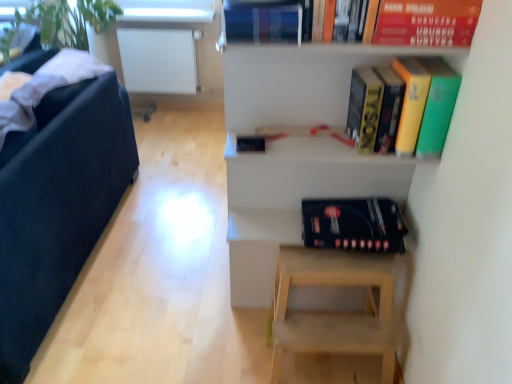
What is the approximate width of white matte radiator at upper left?

The width of white matte radiator at upper left is 8.90 inches.

Identify the location of black fabric armchair at left. (58, 206).

This screenshot has height=384, width=512. Describe the element at coordinates (58, 206) in the screenshot. I see `black fabric armchair at left` at that location.

The image size is (512, 384). I want to click on hardcover book at upper center, the 1th paperback book viewed from the left, so click(263, 21).

Find the location of a particular element. The image size is (512, 384). white matte radiator at upper left is located at coordinates (158, 60).

Is black fabric armchair at left facing towards white matte shelf at upper right?

No, black fabric armchair at left is not oriented towards white matte shelf at upper right.

You are a GUI agent. You are given a task and a screenshot of the screen. Output one action in this format:
    pyautogui.click(x=<x>, y=<y>)
    Task: Click on the armchair below the white matte shelf at upper right (from a real-world perspective)
    The width and height of the screenshot is (512, 384).
    Given the screenshot: What is the action you would take?
    pyautogui.click(x=58, y=206)

Considering the sizes of black fabric armchair at left and white matte shelf at upper right in the image, is black fabric armchair at left taller or shorter than white matte shelf at upper right?

Considering their sizes, black fabric armchair at left has less height than white matte shelf at upper right.

Is point (10, 203) more distant than point (234, 161)?

No, (10, 203) is closer to viewer.

Looking at the image, does orange matte paperback book at upper right, which appears as the first paperback book when viewed from the right, seem bigger or smaller compared to black matte album at lower center?

orange matte paperback book at upper right, which appears as the first paperback book when viewed from the right, is smaller than black matte album at lower center.

Between orange matte paperback book at upper right, which appears as the first paperback book when viewed from the right, and black matte album at lower center, which one appears on the right side from the viewer's perspective?

From the viewer's perspective, orange matte paperback book at upper right, which appears as the first paperback book when viewed from the right, appears more on the right side.

Can you confirm if orange matte paperback book at upper right, which appears as the first paperback book when viewed from the right, is thinner than black matte album at lower center?

Yes.

What's the angular difference between orange matte paperback book at upper right, positioned as the second paperback book in left-to-right order, and black matte album at lower center's facing directions?

11.2 degrees separate the facing orientations of orange matte paperback book at upper right, positioned as the second paperback book in left-to-right order, and black matte album at lower center.

Would you say hardcover book at upper center, placed as the 2th paperback book when sorted from right to left, contains hardcover book at upper right?

No, hardcover book at upper right is not inside hardcover book at upper center, placed as the 2th paperback book when sorted from right to left.

Is hardcover book at upper center, the 1th paperback book viewed from the left, bigger than hardcover book at upper right?

Incorrect, hardcover book at upper center, the 1th paperback book viewed from the left, is not larger than hardcover book at upper right.

The width and height of the screenshot is (512, 384). I want to click on the 1st paperback book above the hardcover book at upper right (from a real-world perspective), so click(263, 21).

Is hardcover book at upper center, the 1th paperback book viewed from the left, directly adjacent to hardcover book at upper right?

hardcover book at upper center, the 1th paperback book viewed from the left, and hardcover book at upper right are clearly separated.

Which is correct: black fabric armchair at left is inside white matte radiator at upper left, or outside of it?

The correct answer is: outside.

From a real-world perspective, does black fabric armchair at left stand above white matte radiator at upper left?

Yes, from a real-world perspective, black fabric armchair at left is above white matte radiator at upper left.

Which object is positioned more to the right, black fabric armchair at left or white matte radiator at upper left?

Positioned to the right is white matte radiator at upper left.

From a real-world perspective, is black matte album at lower center positioned above or below white matte radiator at upper left?

Clearly, from a real-world perspective, black matte album at lower center is above white matte radiator at upper left.

Is black matte album at lower center facing away from white matte radiator at upper left?

black matte album at lower center is not turned away from white matte radiator at upper left.

Considering the sizes of objects black matte album at lower center and white matte radiator at upper left in the image provided, who is wider, black matte album at lower center or white matte radiator at upper left?

black matte album at lower center is wider.

Are black matte album at lower center and white matte radiator at upper left beside each other?

There is a gap between black matte album at lower center and white matte radiator at upper left.

Is white matte radiator at upper left not within white matte shelf at upper right?

Yes, white matte radiator at upper left is located beyond the bounds of white matte shelf at upper right.

Is white matte radiator at upper left next to white matte shelf at upper right?

No, white matte radiator at upper left is not next to white matte shelf at upper right.

From a real-world perspective, between white matte radiator at upper left and white matte shelf at upper right, who is vertically higher?

white matte shelf at upper right.

In the image, there is a white matte shelf at upper right. Where is `radiator below it (from a real-world perspective)`? The width and height of the screenshot is (512, 384). radiator below it (from a real-world perspective) is located at coordinates (158, 60).

From the image's perspective, is hardcover book at upper center, the 1th paperback book viewed from the left, above orange matte paperback book at upper right, which appears as the first paperback book when viewed from the right?

No, from the image's perspective, hardcover book at upper center, the 1th paperback book viewed from the left, is not above orange matte paperback book at upper right, which appears as the first paperback book when viewed from the right.

How many degrees apart are the facing directions of hardcover book at upper center, placed as the 2th paperback book when sorted from right to left, and orange matte paperback book at upper right, positioned as the second paperback book in left-to-right order?

The angle between the facing direction of hardcover book at upper center, placed as the 2th paperback book when sorted from right to left, and the facing direction of orange matte paperback book at upper right, positioned as the second paperback book in left-to-right order, is 1.35 degrees.

Is hardcover book at upper center, the 1th paperback book viewed from the left, situated inside orange matte paperback book at upper right, which appears as the first paperback book when viewed from the right, or outside?

hardcover book at upper center, the 1th paperback book viewed from the left, is outside orange matte paperback book at upper right, which appears as the first paperback book when viewed from the right.

Considering the relative sizes of hardcover book at upper center, placed as the 2th paperback book when sorted from right to left, and orange matte paperback book at upper right, which appears as the first paperback book when viewed from the right, in the image provided, is hardcover book at upper center, placed as the 2th paperback book when sorted from right to left, wider than orange matte paperback book at upper right, which appears as the first paperback book when viewed from the right,?

Yes, hardcover book at upper center, placed as the 2th paperback book when sorted from right to left, is wider than orange matte paperback book at upper right, which appears as the first paperback book when viewed from the right.

You are a GUI agent. You are given a task and a screenshot of the screen. Output one action in this format:
    pyautogui.click(x=<x>, y=<y>)
    Task: Click on the shelf above the black fabric armchair at left (from a real-world perspective)
    This screenshot has height=384, width=512.
    Given the screenshot: What is the action you would take?
    pyautogui.click(x=297, y=148)

Locate an element on the screen. The height and width of the screenshot is (384, 512). album below the orange matte paperback book at upper right, which appears as the first paperback book when viewed from the right (from the image's perspective) is located at coordinates (354, 224).

Looking at this image, based on their spatial positions, is white matte radiator at upper left or hardcover book at upper center, the 1th paperback book viewed from the left, closer to hardcover book at upper right?

hardcover book at upper center, the 1th paperback book viewed from the left.

Looking at the image, which one is located closer to white matte radiator at upper left, black fabric armchair at left or black matte album at lower center?

Among the two, black fabric armchair at left is located nearer to white matte radiator at upper left.

From the image, which object appears to be nearer to black matte album at lower center, orange matte paperback book at upper right, which appears as the first paperback book when viewed from the right, or hardcover book at upper center, the 1th paperback book viewed from the left?

orange matte paperback book at upper right, which appears as the first paperback book when viewed from the right.

Based on the photo, based on their spatial positions, is white matte shelf at upper right or black matte album at lower center closer to white matte radiator at upper left?

white matte shelf at upper right.

From the image, which object appears to be nearer to white matte shelf at upper right, hardcover book at upper right or black fabric armchair at left?

hardcover book at upper right.

Estimate the real-world distances between objects in this image. Which object is closer to white matte radiator at upper left, black fabric armchair at left or hardcover book at upper right?

black fabric armchair at left lies closer to white matte radiator at upper left than the other object.

From the image, which object appears to be nearer to white matte radiator at upper left, hardcover book at upper center, the 1th paperback book viewed from the left, or hardcover book at upper right?

Based on the image, hardcover book at upper center, the 1th paperback book viewed from the left, appears to be nearer to white matte radiator at upper left.

Which object lies nearer to the anchor point hardcover book at upper right, black fabric armchair at left or orange matte paperback book at upper right, positioned as the second paperback book in left-to-right order?

orange matte paperback book at upper right, positioned as the second paperback book in left-to-right order, lies closer to hardcover book at upper right than the other object.

You are a GUI agent. You are given a task and a screenshot of the screen. Output one action in this format:
    pyautogui.click(x=<x>, y=<y>)
    Task: Click on the shelf between hardcover book at upper center, the 1th paperback book viewed from the left, and hardcover book at upper right from left to right
    This screenshot has height=384, width=512.
    Given the screenshot: What is the action you would take?
    pyautogui.click(x=297, y=148)

Locate an element on the screen. This screenshot has width=512, height=384. shelf between black fabric armchair at left and orange matte paperback book at upper right, positioned as the second paperback book in left-to-right order, in the horizontal direction is located at coordinates (297, 148).

Find the location of a particular element. shelf between black fabric armchair at left and white matte radiator at upper left in the front-back direction is located at coordinates (297, 148).

The image size is (512, 384). What are the coordinates of `paperback book between orange matte paperback book at upper right, positioned as the second paperback book in left-to-right order, and white matte shelf at upper right, in the vertical direction` in the screenshot? It's located at (263, 21).